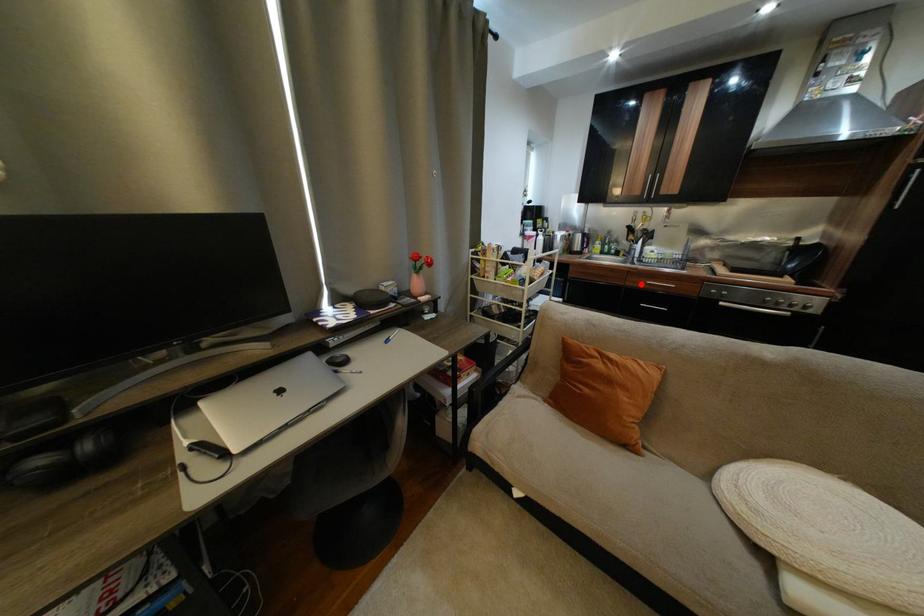
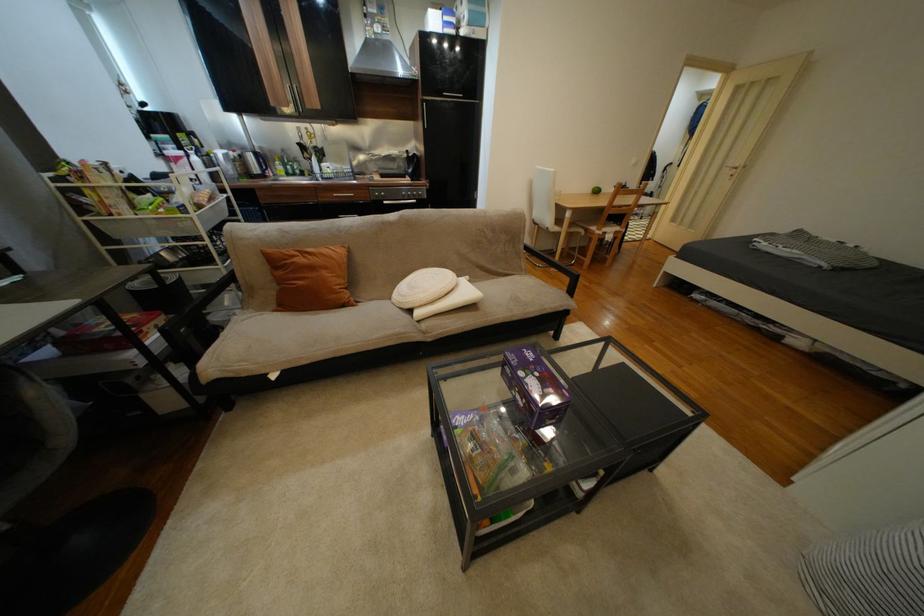
The point at the highlighted location is marked in the first image. Where is the corresponding point in the second image?

(333, 200)